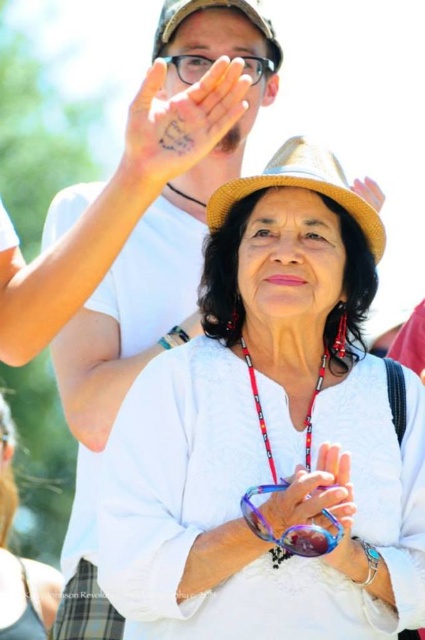
Looking at the scene, which object is positioned to the left of the other between the smooth skin palm at upper center and the matte black glasses at upper center?

The smooth skin palm at upper center is to the left of the matte black glasses at upper center.

You are a photographer trying to capture the perfect shot of the smooth skin palm at upper center. According to the coordinates provided, where should you focus your camera lens to ensure the palm is in the center of the frame?

To center the smooth skin palm at upper center in your frame, focus your camera lens at the coordinates point specified at point (x=181, y=120).